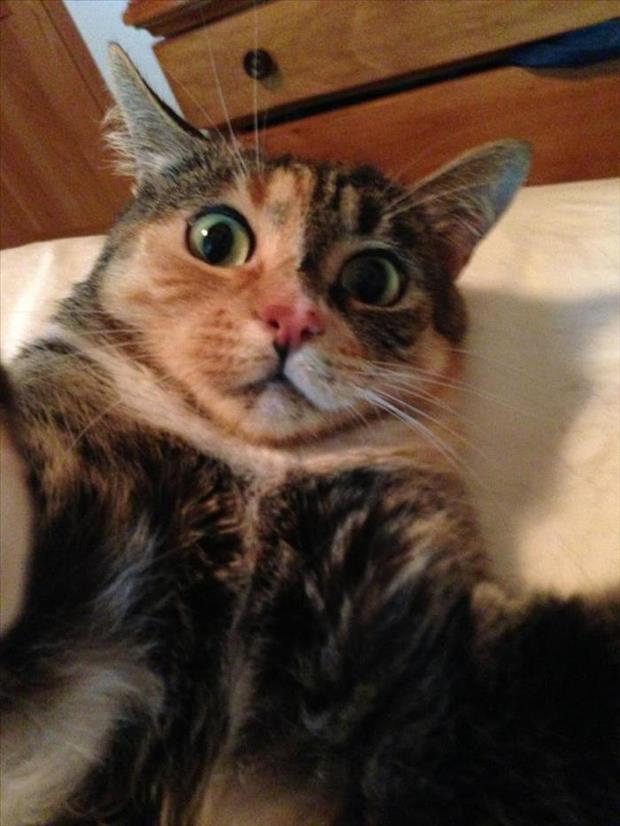
Image resolution: width=620 pixels, height=826 pixels. What are the coordinates of `shadow of cat on bed` in the screenshot? It's located at (529, 380).